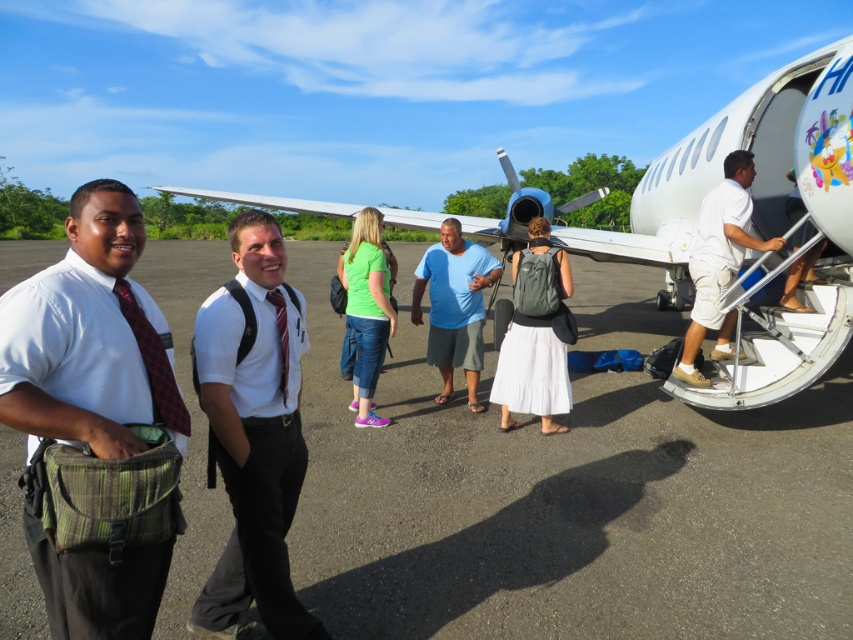
What is the exact location of the green matte shirt at center in the image?

The green matte shirt at center is located at point coordinates of [366,308].

You are a photographer at the airport tarmac. You notice a blue cotton shirt at center and a red silk tie at center in your frame. Which item appears wider in the photo?

The blue cotton shirt at center appears wider than the red silk tie at center because its width surpasses the red silk tie at center.